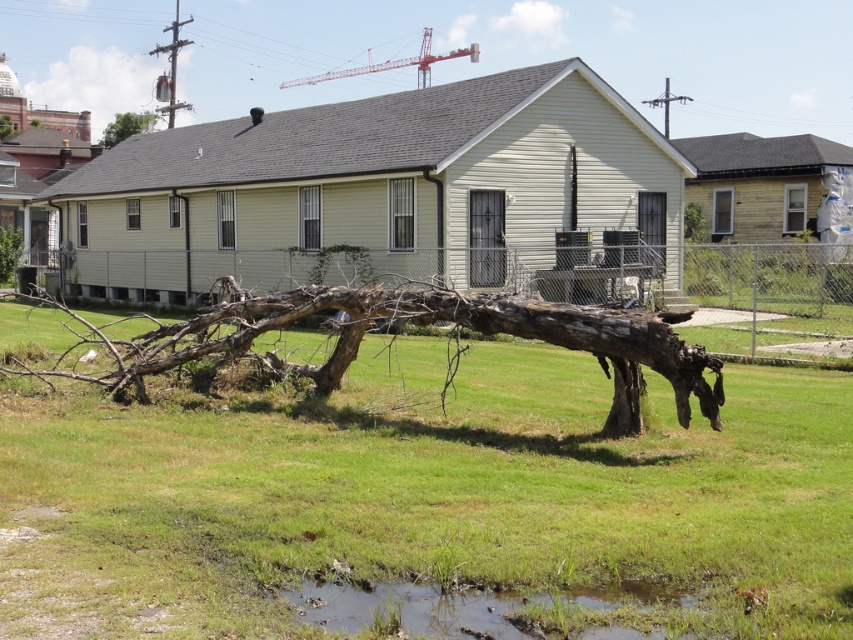
You are a gardener who needs to move the brown rough tree trunk at lower center and the muddy wet grass at lower center. Which object is wider so that you need more space to move it?

The brown rough tree trunk at lower center is wider than the muddy wet grass at lower center, so you need more space to move it.

You are a landscape architect designing a path between the green leafy tree at upper left and the brown rough tree trunk at upper left. What is the minimum length the path should be to ensure it reaches both points?

The minimum length of the path should be at least 13.48 meters to ensure it reaches both the green leafy tree at upper left and the brown rough tree trunk at upper left.

You are a delivery person trying to reach the house. There is a green leafy tree at upper left and a brown rough tree trunk at upper left blocking your path. Can you walk around them? Explain why based on their sizes.

The green leafy tree at upper left is much taller than the brown rough tree trunk at upper left. Since the tree trunk is shorter, you can walk around it, but the tall green leafy tree at upper left might block your path completely.